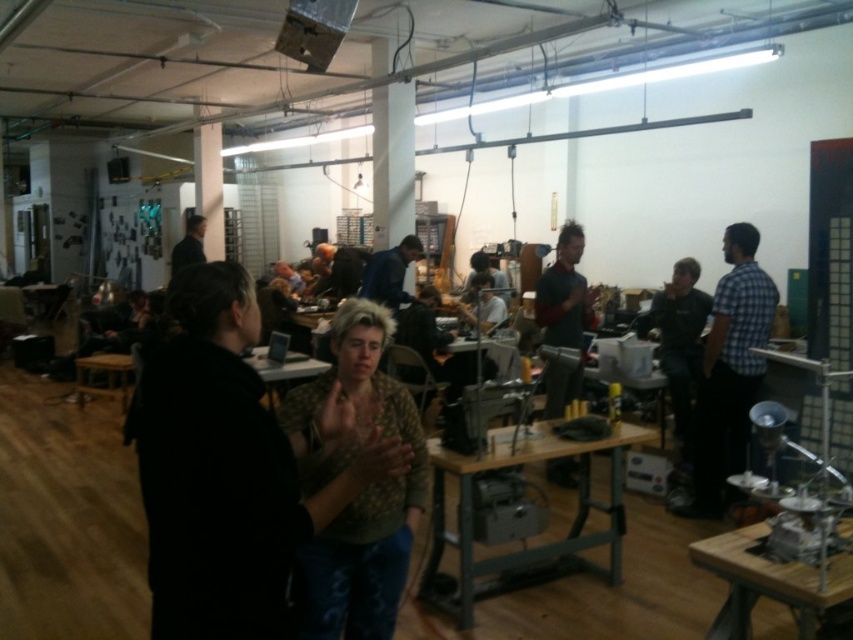
Question: Which object appears closest to the camera in this image?

Choices:
 (A) black shirt at upper left
 (B) camouflage-patterned shirt at center
 (C) wooden at center

Answer: (B)

Question: From the image, what is the correct spatial relationship of camouflage-patterned shirt at center in relation to wooden at center?

Choices:
 (A) right
 (B) left

Answer: (B)

Question: Is green textured shirt at center positioned in front of matte black shirt at center?

Choices:
 (A) yes
 (B) no

Answer: (A)

Question: Which point is farther to the camera?

Choices:
 (A) green textured shirt at center
 (B) camouflage-patterned shirt at center

Answer: (B)

Question: Which point is farther from the camera taking this photo?

Choices:
 (A) (483, 262)
 (B) (721, 552)

Answer: (A)

Question: Can you confirm if dark blue shirt at center is smaller than blue denim jacket at center?

Choices:
 (A) yes
 (B) no

Answer: (A)